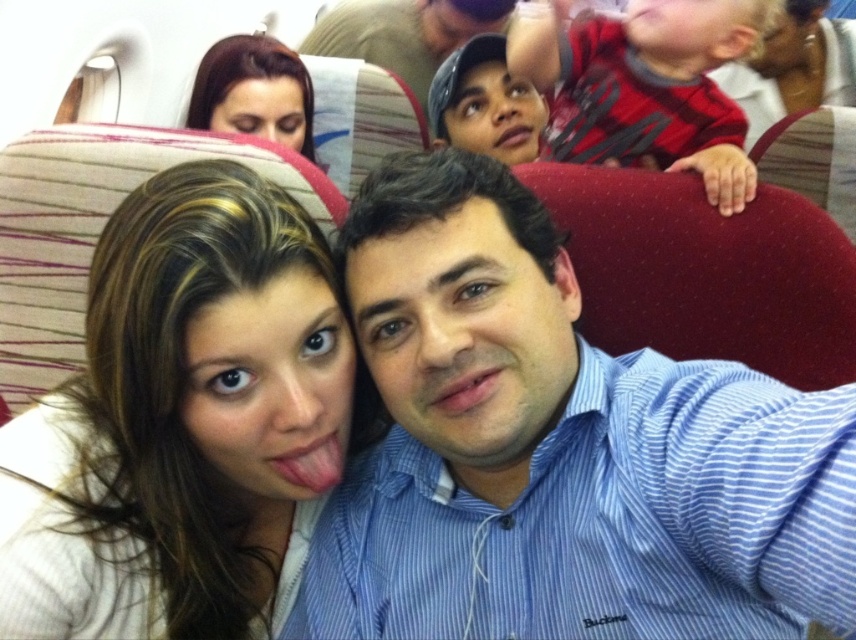
Question: Which point is closer to the camera?

Choices:
 (A) red cotton shirt at upper right
 (B) matte brown cap at upper center
 (C) smooth brown hair at upper left

Answer: (A)

Question: Estimate the real-world distances between objects in this image. Which object is farther from the blue striped shirt at center?

Choices:
 (A) matte brown cap at upper center
 (B) red cotton shirt at upper right

Answer: (A)

Question: Can you confirm if smooth white shirt at center is positioned to the right of smooth brown hair at upper left?

Choices:
 (A) yes
 (B) no

Answer: (A)

Question: Which of these objects is positioned farthest from the red cotton shirt at upper right?

Choices:
 (A) matte black cap at upper center
 (B) blue striped shirt at center
 (C) smooth white shirt at center

Answer: (C)

Question: Can you confirm if matte brown cap at upper center is positioned to the left of smooth brown hair at upper left?

Choices:
 (A) no
 (B) yes

Answer: (A)

Question: In this image, where is smooth white shirt at center located relative to matte black cap at upper center?

Choices:
 (A) below
 (B) above

Answer: (A)